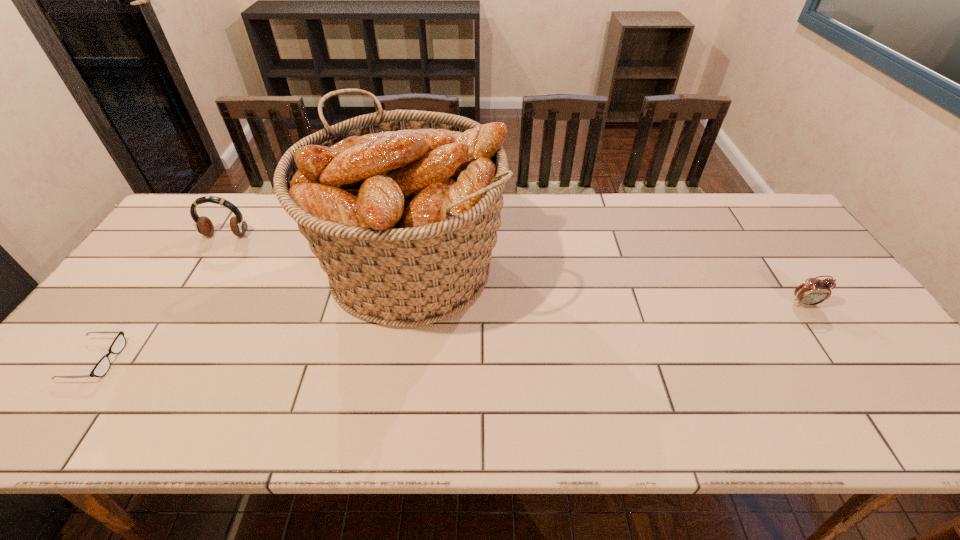
The width and height of the screenshot is (960, 540). I want to click on unoccupied area between the tallest object and the shortest object, so click(252, 314).

Image resolution: width=960 pixels, height=540 pixels. I want to click on the closest object to the second shortest object, so click(x=402, y=207).

The image size is (960, 540). I want to click on object that is the third closest one to the basket, so click(x=813, y=291).

You are a GUI agent. You are given a task and a screenshot of the screen. Output one action in this format:
    pyautogui.click(x=<x>, y=<y>)
    Task: Click on the free space that satisfies the following two spatial constraints: 1. on the face of the third tallest object; 2. on the front-facing side of the spectacles
    The width and height of the screenshot is (960, 540).
    Given the screenshot: What is the action you would take?
    pyautogui.click(x=844, y=360)

You are a GUI agent. You are given a task and a screenshot of the screen. Output one action in this format:
    pyautogui.click(x=<x>, y=<y>)
    Task: Click on the free location that satisfies the following two spatial constraints: 1. on the ear cup of the headset; 2. on the front-facing side of the shortest object
    This screenshot has height=540, width=960.
    Given the screenshot: What is the action you would take?
    pyautogui.click(x=148, y=360)

Find the location of a particular element. vacant space that satisfies the following two spatial constraints: 1. on the face of the second shortest object; 2. on the front-facing side of the spectacles is located at coordinates (844, 360).